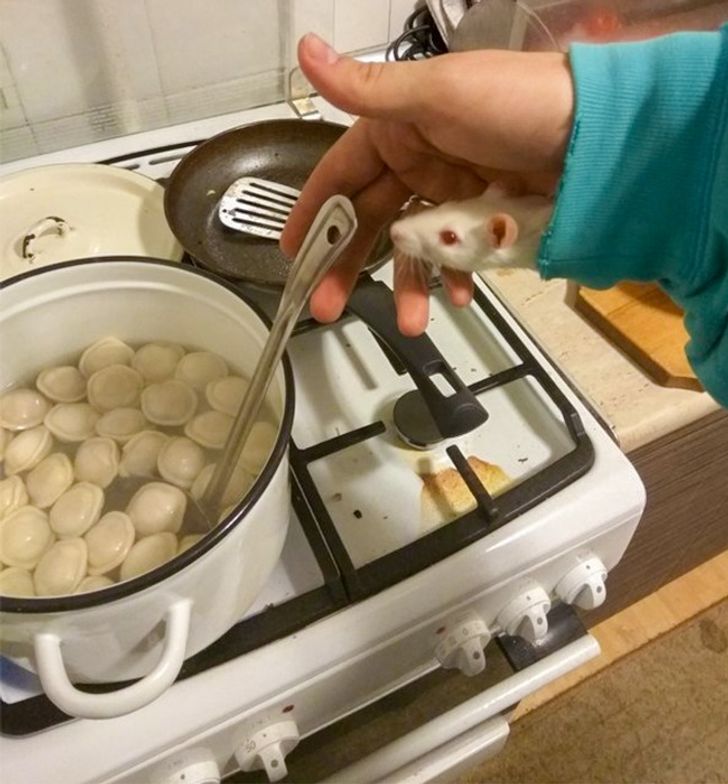
Find the location of a particular element. The width and height of the screenshot is (728, 784). knobs is located at coordinates click(x=470, y=643).